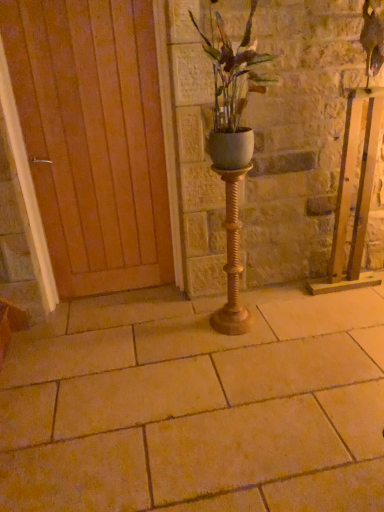
You are a GUI agent. You are given a task and a screenshot of the screen. Output one action in this format:
    pyautogui.click(x=<x>, y=<y>)
    Task: Click on the blank space situated above beige stone pavement at center (from a real-world perspective)
    The image size is (384, 512).
    Given the screenshot: What is the action you would take?
    [228, 377]